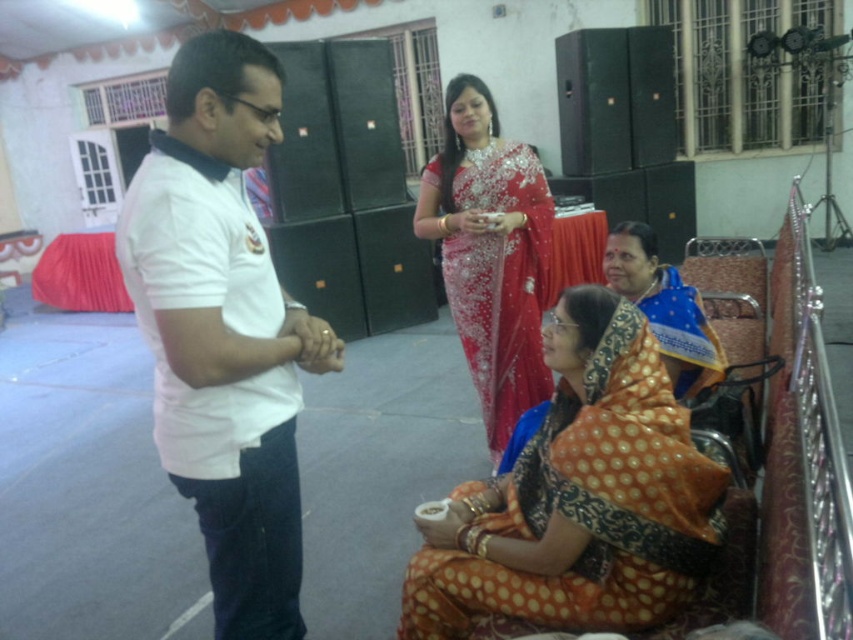
You are a photographer at the event and want to capture a photo that includes both the orange printed saree at center and the orange dotted saree at lower right. What is the minimum distance you need to move backward to ensure both are in frame?

The minimum distance to move backward should be greater than 32.06 inches to ensure both the orange printed saree at center and the orange dotted saree at lower right are within the camera frame.

Looking at this image, you are standing at the point labeled point (657, 260) and want to move towards the point labeled point (535, 512). Which direction should you move to reach your destination?

To move from point (657, 260) to point (535, 512), you should move forward since point (535, 512) is in front of point (657, 260).